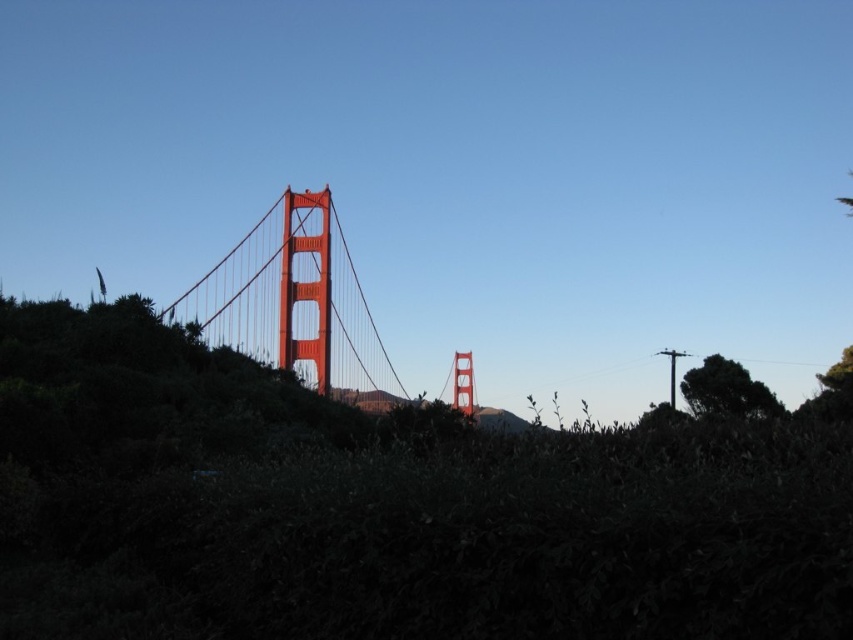
You are a drone operator planning to fly a drone between the glossy steel bridge at center and the green leafy tree at right. The drone has a maximum flight distance of 150 meters. Based on the scene, can the drone safely fly between these two points without exceeding its range?

The glossy steel bridge at center and the green leafy tree at right are 146.89 meters apart from each other. Since the drone has a maximum flight distance of 150 meters, it can safely fly between them without exceeding its range.

You are a photographer planning to capture a shot of the glossy steel bridge at center and the green leafy tree at right. From your current position, can you see both objects clearly in the frame without any obstruction?

The green leafy tree at right is behind the glossy steel bridge at center, so the tree will be partially or fully obscured by the bridge in your photo.

You are a photographer standing at the base of the Golden Gate Bridge. You want to take a photo that includes both the point at coordinate point [305,262] and the point at coordinate point [717,387]. Which point should you focus on first to ensure both are in the frame?

You should focus on point [717,387] first because point [305,262] is behind it, ensuring both points are captured in the photo.